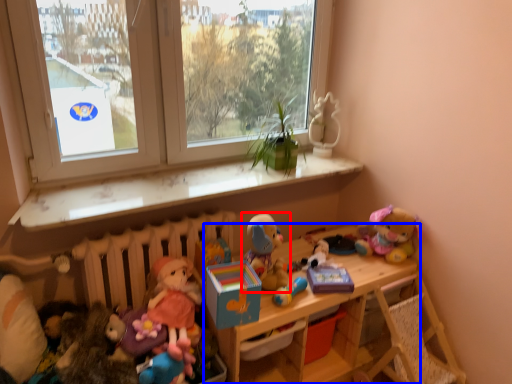
Question: Which object appears closest to the camera in this image, toy (highlighted by a red box) or shelf (highlighted by a blue box)?

Choices:
 (A) toy
 (B) shelf

Answer: (B)